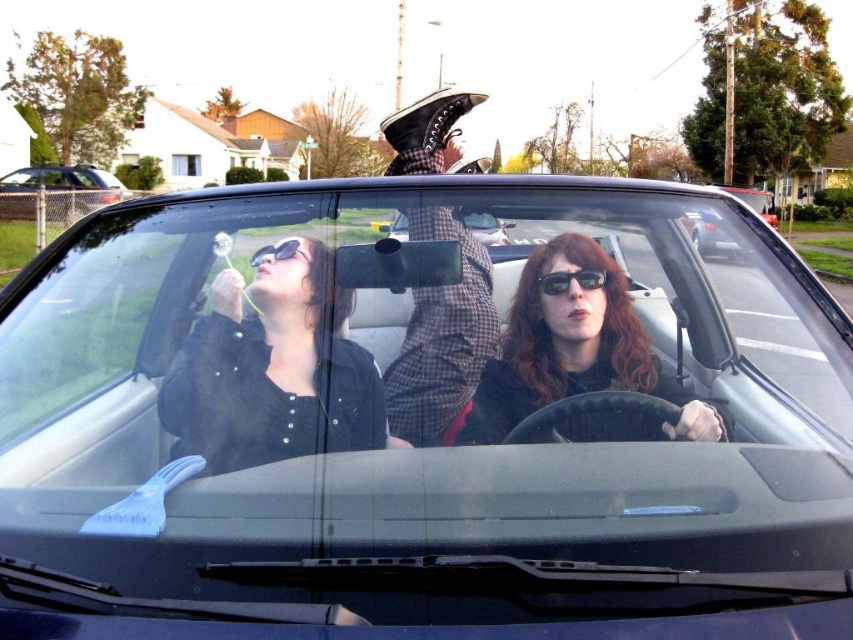
Can you confirm if checkered fabric shirt at center is positioned below matte black convertible at center?

Correct, checkered fabric shirt at center is located below matte black convertible at center.

Can you confirm if checkered fabric shirt at center is positioned to the left of matte black convertible at center?

No, checkered fabric shirt at center is not to the left of matte black convertible at center.

Who is more distant from viewer, (466, 316) or (16, 202)?

The point (16, 202) is more distant.

I want to click on checkered fabric shirt at center, so click(x=442, y=339).

Which is more to the right, black leather convertible at center or black matte jacket at upper left?

From the viewer's perspective, black leather convertible at center appears more on the right side.

Is black leather convertible at center below black matte jacket at upper left?

Incorrect, black leather convertible at center is not positioned below black matte jacket at upper left.

You are a GUI agent. You are given a task and a screenshot of the screen. Output one action in this format:
    pyautogui.click(x=<x>, y=<y>)
    Task: Click on the black leather convertible at center
    Image resolution: width=853 pixels, height=640 pixels.
    Given the screenshot: What is the action you would take?
    pyautogui.click(x=422, y=420)

Can you confirm if matte black sunglasses at center is thinner than checkered fabric shirt at center?

In fact, matte black sunglasses at center might be wider than checkered fabric shirt at center.

Which is below, matte black sunglasses at center or checkered fabric shirt at center?

Positioned lower is matte black sunglasses at center.

Which is behind, point (608, 330) or point (421, 204)?

Point (421, 204)

The image size is (853, 640). In order to click on matte black sunglasses at center in this screenshot , I will do pos(578,356).